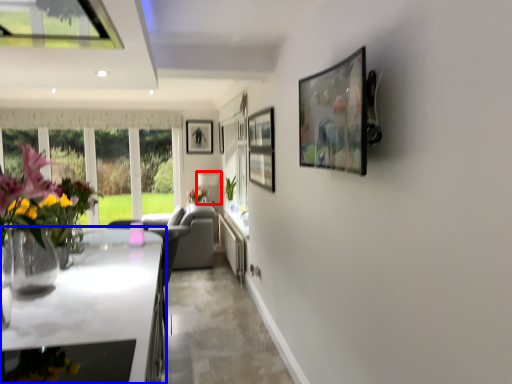
Question: Which of the following is the farthest to the observer, lamp (highlighted by a red box) or countertop (highlighted by a blue box)?

Choices:
 (A) lamp
 (B) countertop

Answer: (A)